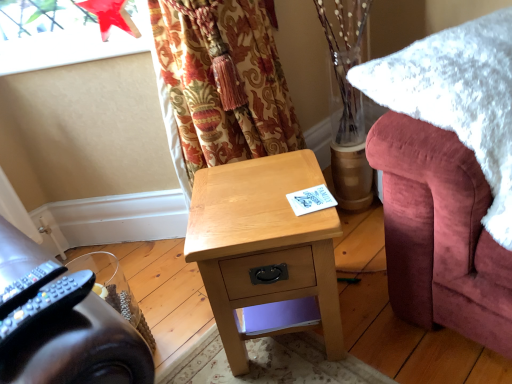
Question: From their relative heights in the image, would you say black plastic remote control at lower left, the first remote control from the left, is taller or shorter than white fluffy blanket at right?

Choices:
 (A) short
 (B) tall

Answer: (A)

Question: Choose the correct answer: Is black plastic remote control at lower left, the first remote control from the left, inside white fluffy blanket at right or outside it?

Choices:
 (A) inside
 (B) outside

Answer: (B)

Question: Which is nearer to the light wood desk at center?

Choices:
 (A) transparent glass window screen at upper left
 (B) black plastic remote control at lower left, the first remote control from the left
 (C) black plastic remote control at lower left, the 2th remote control from the left
 (D) white fluffy blanket at right

Answer: (D)

Question: Considering the real-world distances, which object is closest to the black plastic remote control at lower left, the first remote control from the left?

Choices:
 (A) black plastic remote control at lower left, the 2th remote control from the left
 (B) white fluffy blanket at right
 (C) transparent glass window screen at upper left
 (D) light wood desk at center

Answer: (A)